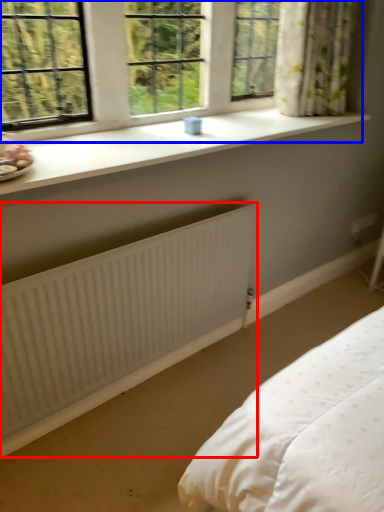
Question: Among these objects, which one is farthest to the camera, radiator (highlighted by a red box) or window (highlighted by a blue box)?

Choices:
 (A) radiator
 (B) window

Answer: (B)